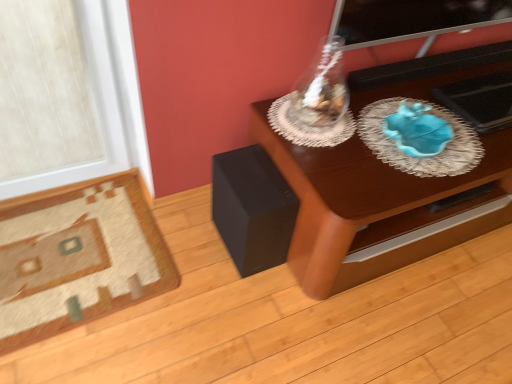
Question: Could black matte speaker at lower left be considered to be inside carpeted rug at lower left?

Choices:
 (A) no
 (B) yes

Answer: (A)

Question: Is carpeted rug at lower left oriented towards black matte speaker at lower left?

Choices:
 (A) yes
 (B) no

Answer: (B)

Question: Is carpeted rug at lower left located outside black matte speaker at lower left?

Choices:
 (A) no
 (B) yes

Answer: (B)

Question: Considering the relative sizes of carpeted rug at lower left and black matte speaker at lower left in the image provided, is carpeted rug at lower left taller than black matte speaker at lower left?

Choices:
 (A) yes
 (B) no

Answer: (B)

Question: Considering the relative sizes of carpeted rug at lower left and black matte speaker at lower left in the image provided, is carpeted rug at lower left thinner than black matte speaker at lower left?

Choices:
 (A) no
 (B) yes

Answer: (A)

Question: Considering the relative sizes of carpeted rug at lower left and black matte speaker at lower left in the image provided, is carpeted rug at lower left bigger than black matte speaker at lower left?

Choices:
 (A) no
 (B) yes

Answer: (A)

Question: Does wooden table at center have a smaller size compared to transparent glass vase at upper center?

Choices:
 (A) yes
 (B) no

Answer: (B)

Question: Is wooden table at center bigger than transparent glass vase at upper center?

Choices:
 (A) no
 (B) yes

Answer: (B)

Question: Considering the relative sizes of wooden table at center and transparent glass vase at upper center in the image provided, is wooden table at center wider than transparent glass vase at upper center?

Choices:
 (A) yes
 (B) no

Answer: (A)

Question: Is wooden table at center in front of transparent glass vase at upper center?

Choices:
 (A) yes
 (B) no

Answer: (A)

Question: Can you confirm if wooden table at center is shorter than transparent glass vase at upper center?

Choices:
 (A) no
 (B) yes

Answer: (A)

Question: Would you say wooden table at center contains transparent glass vase at upper center?

Choices:
 (A) yes
 (B) no

Answer: (B)

Question: Is carpeted rug at lower left at the back of transparent glass vase at upper center?

Choices:
 (A) yes
 (B) no

Answer: (B)